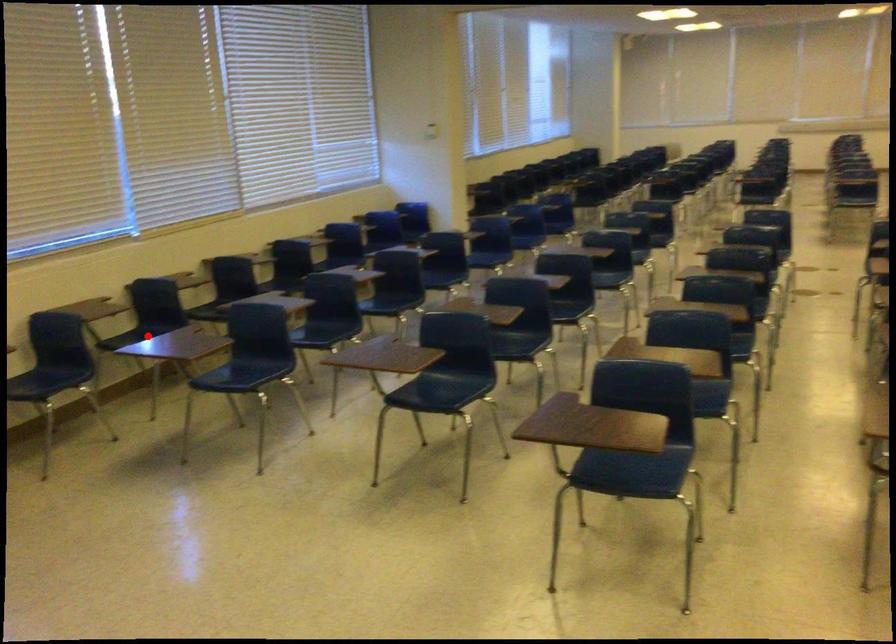
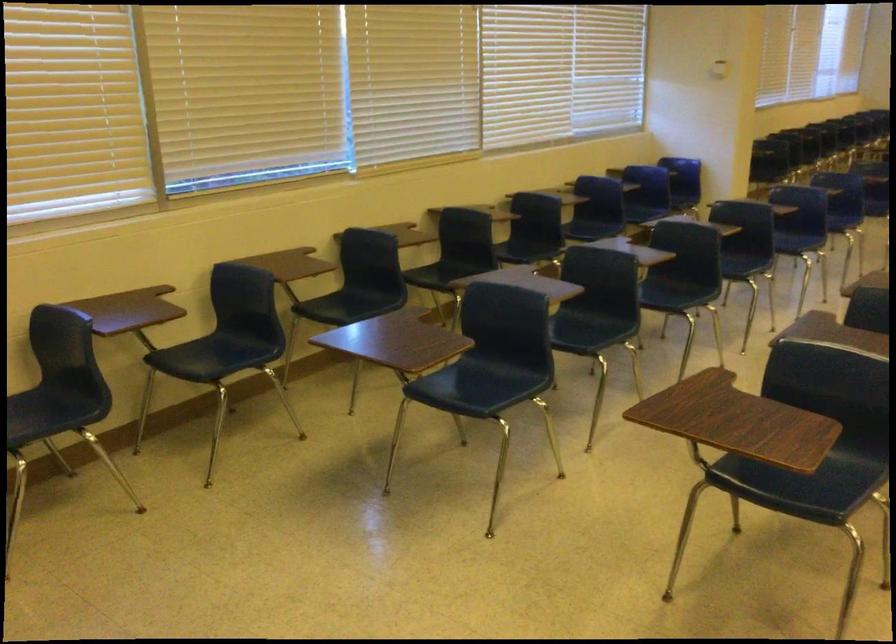
The point at the highlighted location is marked in the first image. Where is the corresponding point in the second image?

(359, 303)